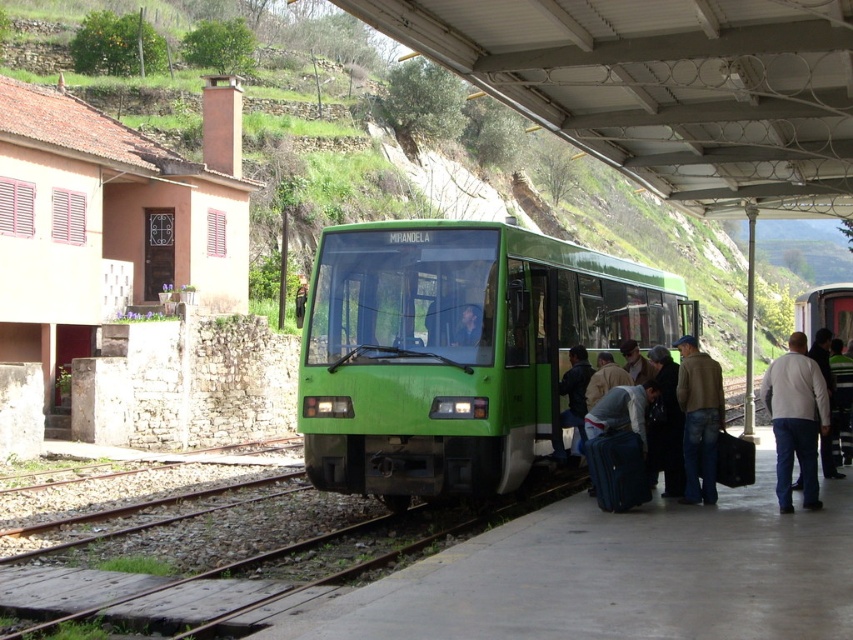
Question: Can you confirm if green matte train at center is positioned to the left of denim jeans at lower right?

Choices:
 (A) yes
 (B) no

Answer: (A)

Question: Can you confirm if denim jeans at lower right is thinner than smooth blue shirt at center?

Choices:
 (A) no
 (B) yes

Answer: (A)

Question: Does green matte train at center have a lesser width compared to white cotton shirt at right?

Choices:
 (A) yes
 (B) no

Answer: (A)

Question: Which of these objects is positioned farthest from the white cotton shirt at right?

Choices:
 (A) denim jeans at lower right
 (B) smooth blue shirt at center

Answer: (B)

Question: Which object is the farthest from the white cotton shirt at right?

Choices:
 (A) green matte train at center
 (B) denim jeans at lower right

Answer: (A)

Question: Among these points, which one is farthest from the camera?

Choices:
 (A) (788, 492)
 (B) (454, 342)

Answer: (B)